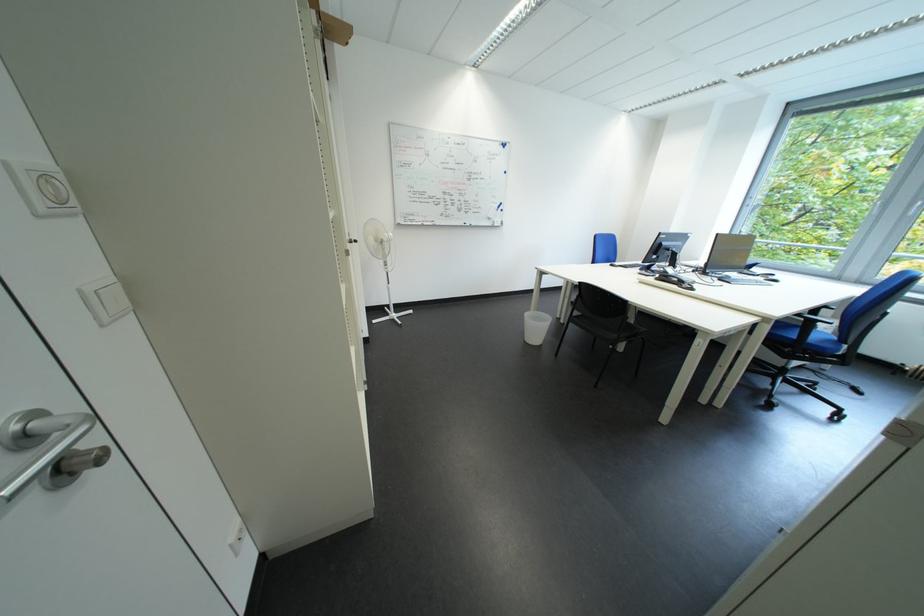
At what (x,y) coordinates should I click in order to perform the action: click on cardboard box. Please return your answer as a coordinate pair (x, y). The width and height of the screenshot is (924, 616). Looking at the image, I should click on (332, 26).